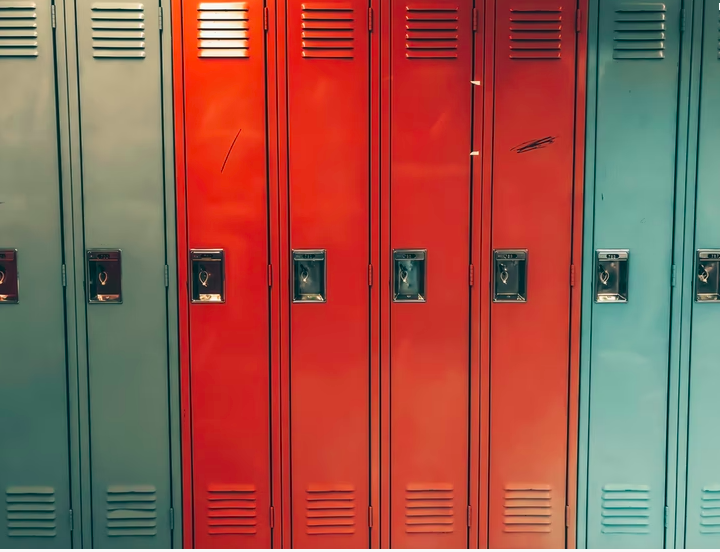
Locate an element on the screen. The height and width of the screenshot is (552, 720). green lockers is located at coordinates (125, 151), (22, 215).